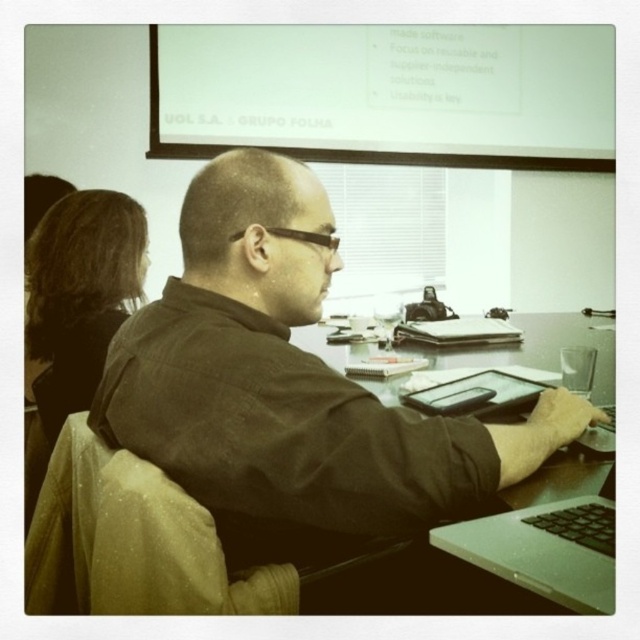
Question: Does silver metallic computer desk at center have a smaller size compared to brown hair at upper left?

Choices:
 (A) no
 (B) yes

Answer: (A)

Question: Is black matte shirt at center closer to camera compared to silver metallic computer desk at center?

Choices:
 (A) yes
 (B) no

Answer: (B)

Question: Among these points, which one is farthest from the camera?

Choices:
 (A) (456, 547)
 (B) (106, 248)

Answer: (B)

Question: Which of the following is the farthest from the observer?

Choices:
 (A) (52, 340)
 (B) (221, 525)
 (C) (557, 328)

Answer: (C)

Question: Which object is farther from the camera taking this photo?

Choices:
 (A) silver metallic computer desk at center
 (B) black matte shirt at center

Answer: (B)

Question: Is black matte shirt at center wider than brown hair at upper left?

Choices:
 (A) no
 (B) yes

Answer: (B)